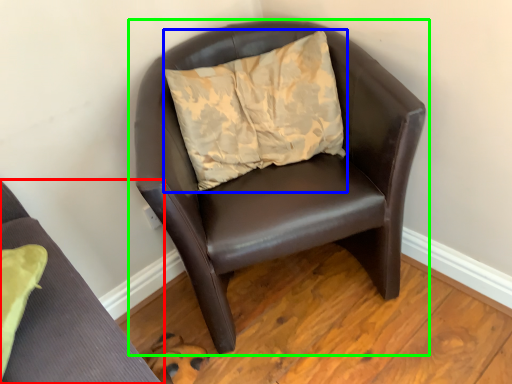
Question: Based on their relative distances, which object is farther from chair (highlighted by a red box)? Choose from pillow (highlighted by a blue box) and chair (highlighted by a green box).

Choices:
 (A) pillow
 (B) chair

Answer: (A)